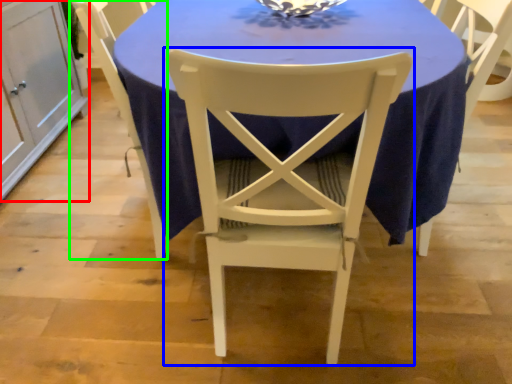
Question: Which object is the closest to the cabinetry (highlighted by a red box)? Choose among these: chair (highlighted by a blue box) or chair (highlighted by a green box).

Choices:
 (A) chair
 (B) chair

Answer: (B)